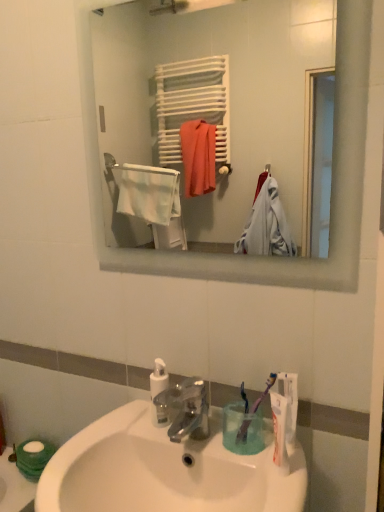
At what (x,y) coordinates should I click in order to perform the action: click on free location in front of purple plastic toothbrush at lower center, which ranks as the 2th toothbrush in right-to-left order. Please return your answer as a coordinate pair (x, y). This screenshot has height=512, width=384. Looking at the image, I should click on (267, 464).